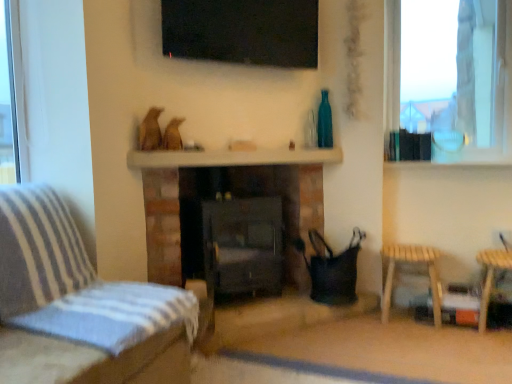
Question: Is the depth of transparent glass window at upper right greater than that of black glass tv at upper center?

Choices:
 (A) no
 (B) yes

Answer: (B)

Question: Is transparent glass window at upper right with black glass tv at upper center?

Choices:
 (A) no
 (B) yes

Answer: (A)

Question: Considering the relative sizes of transparent glass window at upper right and black glass tv at upper center in the image provided, is transparent glass window at upper right wider than black glass tv at upper center?

Choices:
 (A) no
 (B) yes

Answer: (B)

Question: Does transparent glass window at upper right have a greater height compared to black glass tv at upper center?

Choices:
 (A) no
 (B) yes

Answer: (B)

Question: Considering the relative positions of transparent glass window at upper right and black glass tv at upper center in the image provided, is transparent glass window at upper right to the right of black glass tv at upper center from the viewer's perspective?

Choices:
 (A) yes
 (B) no

Answer: (A)

Question: Considering the positions of white glossy mantle at center and teal glass bottle at upper right in the image, is white glossy mantle at center wider or thinner than teal glass bottle at upper right?

Choices:
 (A) wide
 (B) thin

Answer: (A)

Question: In terms of height, does white glossy mantle at center look taller or shorter compared to teal glass bottle at upper right?

Choices:
 (A) tall
 (B) short

Answer: (B)

Question: Which is correct: white glossy mantle at center is inside teal glass bottle at upper right, or outside of it?

Choices:
 (A) outside
 (B) inside

Answer: (A)

Question: Does point [152, 155] appear closer or farther from the camera than point [322, 147]?

Choices:
 (A) farther
 (B) closer

Answer: (B)

Question: Considering their positions, is teal glass bottle at upper right located in front of or behind striped fabric couch at left?

Choices:
 (A) front
 (B) behind

Answer: (B)

Question: Visually, is teal glass bottle at upper right positioned to the left or to the right of striped fabric couch at left?

Choices:
 (A) right
 (B) left

Answer: (A)

Question: Does point (323, 89) appear closer or farther from the camera than point (136, 332)?

Choices:
 (A) farther
 (B) closer

Answer: (A)

Question: From a real-world perspective, is teal glass bottle at upper right positioned above or below striped fabric couch at left?

Choices:
 (A) above
 (B) below

Answer: (A)

Question: In the image, is black glass tv at upper center on the left side or the right side of wooden stool at lower right?

Choices:
 (A) right
 (B) left

Answer: (B)

Question: From the image's perspective, relative to wooden stool at lower right, is black glass tv at upper center above or below?

Choices:
 (A) above
 (B) below

Answer: (A)